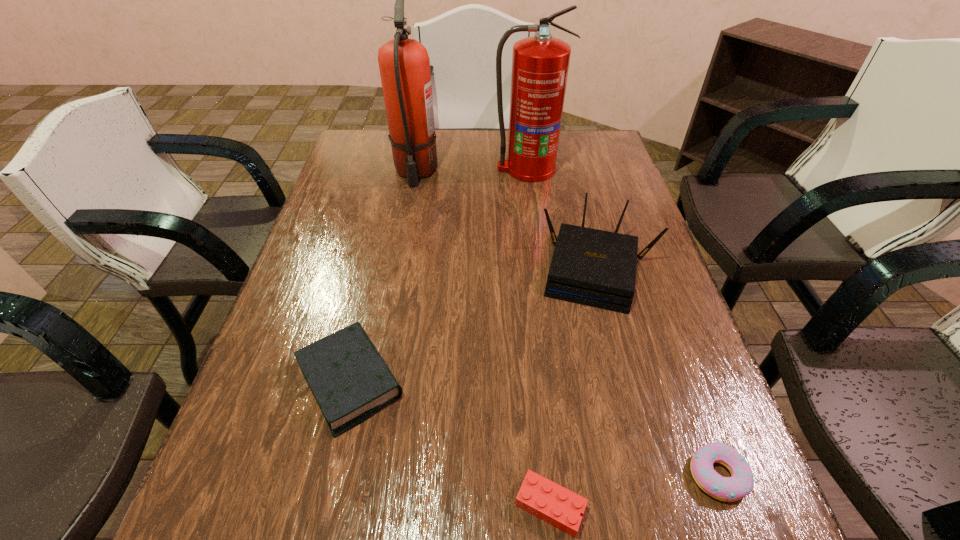
Image resolution: width=960 pixels, height=540 pixels. Identify the location of blank region between the right fire extinguisher and the fourth tallest object. (439, 275).

At what (x,y) coordinates should I click in order to perform the action: click on vacant area that lies between the doughnut and the Bible. Please return your answer as a coordinate pair (x, y). Looking at the image, I should click on (534, 428).

In order to click on object identified as the third closest to the left fire extinguisher in this screenshot , I will do `click(349, 379)`.

You are a GUI agent. You are given a task and a screenshot of the screen. Output one action in this format:
    pyautogui.click(x=<x>, y=<y>)
    Task: Click on the object identified as the fourth closest to the Lego
    The width and height of the screenshot is (960, 540).
    Given the screenshot: What is the action you would take?
    pyautogui.click(x=404, y=64)

Identify the location of vacant area in the image that satisfies the following two spatial constraints: 1. on the back side of the third tallest object; 2. on the right side of the Lego. Image resolution: width=960 pixels, height=540 pixels. (525, 268).

Where is `free location that satisfies the following two spatial constraints: 1. on the nozzle of the left fire extinguisher; 2. on the right side of the Lego`? free location that satisfies the following two spatial constraints: 1. on the nozzle of the left fire extinguisher; 2. on the right side of the Lego is located at coordinates (354, 506).